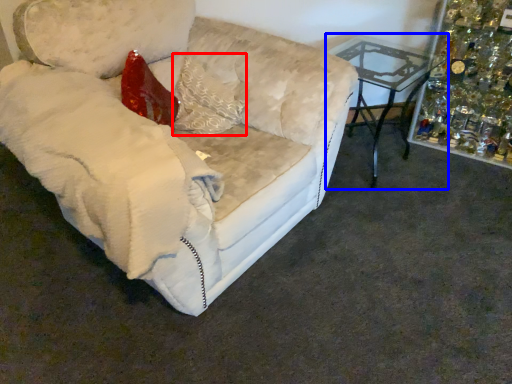
Question: Among these objects, which one is farthest to the camera, pillow (highlighted by a red box) or table (highlighted by a blue box)?

Choices:
 (A) pillow
 (B) table

Answer: (B)